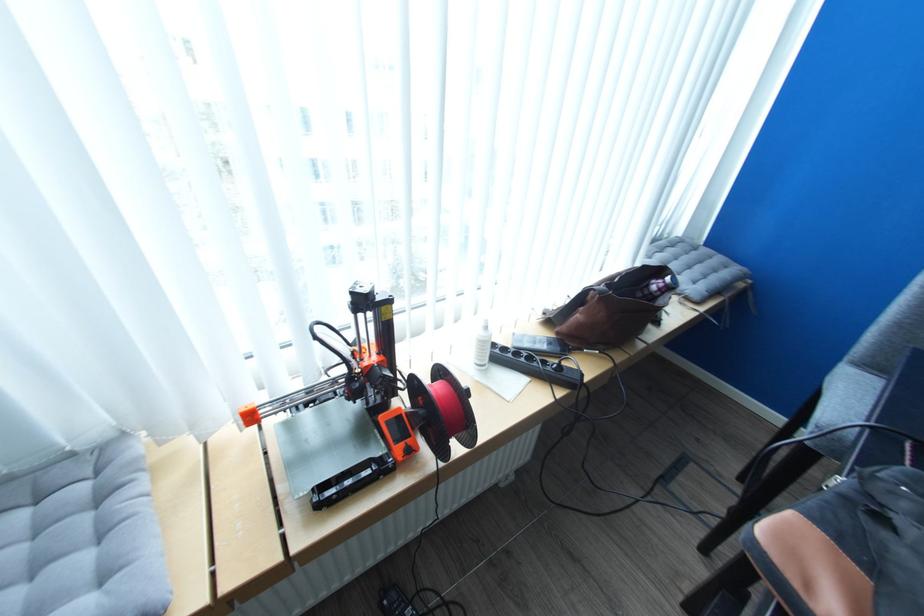
You are a GUI agent. You are given a task and a screenshot of the screen. Output one action in this format:
    pyautogui.click(x=<x>, y=<y>)
    Task: Click on the brown leather bag
    This screenshot has width=924, height=616.
    Given the screenshot: What is the action you would take?
    pyautogui.click(x=623, y=306)